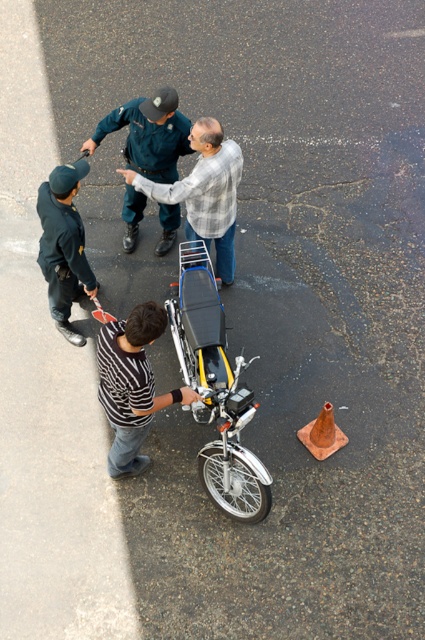
Question: Among these objects, which one is farthest from the camera?

Choices:
 (A) plaid shirt at center
 (B) orange matte traffic cone at lower right
 (C) striped fabric shirt at center

Answer: (B)

Question: Which object is farther from the camera taking this photo?

Choices:
 (A) dark blue uniform at left
 (B) orange matte traffic cone at lower right

Answer: (B)

Question: Does striped fabric shirt at center have a greater width compared to plaid shirt at center?

Choices:
 (A) yes
 (B) no

Answer: (B)

Question: Where is black matte motorcycle at center located in relation to striped fabric shirt at center in the image?

Choices:
 (A) left
 (B) right

Answer: (B)

Question: Observing the image, what is the correct spatial positioning of black matte motorcycle at center in reference to dark blue uniform at left?

Choices:
 (A) right
 (B) left

Answer: (A)

Question: Which point is farther from the camera taking this photo?

Choices:
 (A) (167, 221)
 (B) (326, 413)
 (C) (90, 291)
 (D) (146, 397)

Answer: (A)